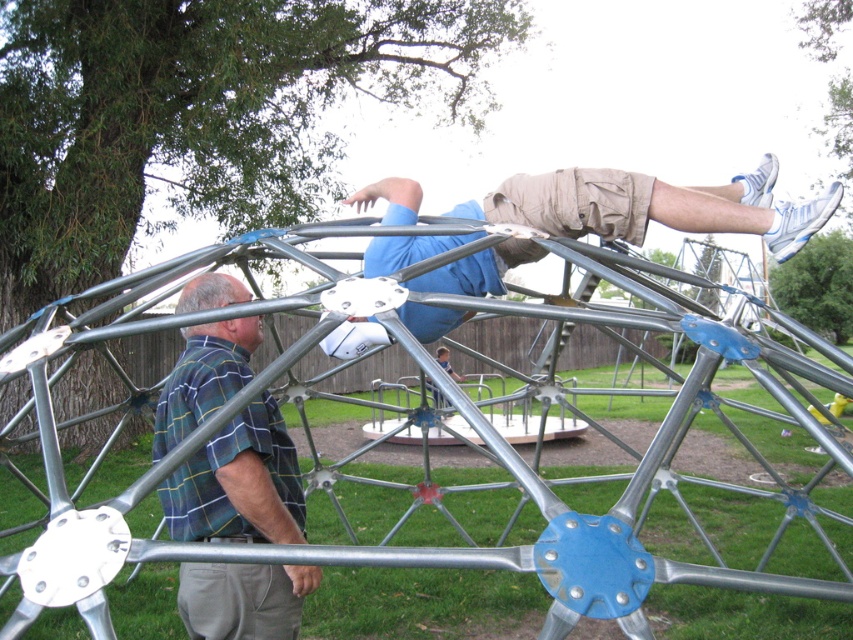
Is green plaid shirt at left closer to camera compared to light brown fabric shorts at upper center?

That is True.

Is green plaid shirt at left bigger than light brown fabric shorts at upper center?

No.

This screenshot has height=640, width=853. What do you see at coordinates (239, 483) in the screenshot?
I see `green plaid shirt at left` at bounding box center [239, 483].

At what (x,y) coordinates should I click in order to perform the action: click on green plaid shirt at left. Please return your answer as a coordinate pair (x, y). The image size is (853, 640). Looking at the image, I should click on (239, 483).